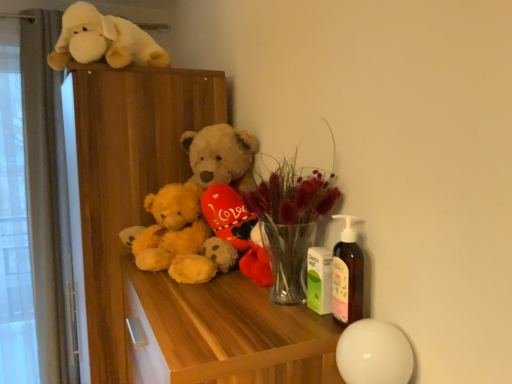
What do you see at coordinates (220, 157) in the screenshot?
I see `fluffy yellow teddy bear at center, which appears as the 2th teddy bear when viewed from the left` at bounding box center [220, 157].

What do you see at coordinates (223, 333) in the screenshot? I see `wooden table at center` at bounding box center [223, 333].

The image size is (512, 384). What are the coordinates of `fluffy yellow teddy bear at center, which appears as the 2th teddy bear when viewed from the left` in the screenshot? It's located at (220, 157).

Is green matte lotion bottle at center, which is the 1th toy in bottom-to-top order, placed right next to translucent glass vase at center?

No.

Considering the sizes of objects green matte lotion bottle at center, the 2th toy positioned from the back, and translucent glass vase at center in the image provided, who is wider, green matte lotion bottle at center, the 2th toy positioned from the back, or translucent glass vase at center?

translucent glass vase at center.

Is green matte lotion bottle at center, the 2th toy positioned from the back, behind translucent glass vase at center?

Yes, green matte lotion bottle at center, the 2th toy positioned from the back, is further from the viewer.

Between wooden table at center and white plush dog at upper left, which is the 2th toy from right to left, which one has more height?

wooden table at center is taller.

Does wooden table at center contain white plush dog at upper left, the 2th toy viewed from the front?

No, wooden table at center does not contain white plush dog at upper left, the 2th toy viewed from the front.

Is wooden table at center thinner than white plush dog at upper left, the first toy positioned from the left?

No.

From the image's perspective, would you say wooden table at center is shown under white plush dog at upper left, which is the first toy in back-to-front order?

Correct, wooden table at center appears lower than white plush dog at upper left, which is the first toy in back-to-front order, in the image.

There is a wooden dresser at upper left. Where is `the 2nd teddy bear above it (from a real-world perspective)`? the 2nd teddy bear above it (from a real-world perspective) is located at coordinates (220, 157).

What's the angular difference between wooden dresser at upper left and fluffy yellow teddy bear at center, which appears as the 2th teddy bear when viewed from the left,'s facing directions?

They differ by 35.8 degrees in their facing directions.

From the image's perspective, which is above, wooden dresser at upper left or fluffy yellow teddy bear at center, which appears as the 2th teddy bear when viewed from the left?

fluffy yellow teddy bear at center, which appears as the 2th teddy bear when viewed from the left, from the image's perspective.

Does wooden dresser at upper left have a lesser width compared to fluffy yellow teddy bear at center, which appears as the 2th teddy bear when viewed from the left?

No, wooden dresser at upper left is not thinner than fluffy yellow teddy bear at center, which appears as the 2th teddy bear when viewed from the left.

Does white plush dog at upper left, the 2th toy viewed from the front, have a greater width compared to wooden table at center?

No, white plush dog at upper left, the 2th toy viewed from the front, is not wider than wooden table at center.

Is white plush dog at upper left, the 2th toy viewed from the front, smaller than wooden table at center?

Yes, white plush dog at upper left, the 2th toy viewed from the front, is smaller than wooden table at center.

In the scene shown: Can you confirm if white plush dog at upper left, the 2th toy viewed from the front, is shorter than wooden table at center?

Indeed, white plush dog at upper left, the 2th toy viewed from the front, has a lesser height compared to wooden table at center.

Which is more to the right, white plush dog at upper left, which is the 2th toy from right to left, or wooden table at center?

Positioned to the right is wooden table at center.

Is fluffy yellow teddy bear at center, the first teddy bear viewed from the right, wider than white plush dog at upper left, placed as the first toy when sorted from top to bottom?

In fact, fluffy yellow teddy bear at center, the first teddy bear viewed from the right, might be narrower than white plush dog at upper left, placed as the first toy when sorted from top to bottom.

Is fluffy yellow teddy bear at center, which appears as the 2th teddy bear when viewed from the left, in front of or behind white plush dog at upper left, the first toy positioned from the left, in the image?

Clearly, fluffy yellow teddy bear at center, which appears as the 2th teddy bear when viewed from the left, is in front of white plush dog at upper left, the first toy positioned from the left.

Which object is positioned more to the left, fluffy yellow teddy bear at center, the first teddy bear viewed from the right, or white plush dog at upper left, the first toy positioned from the left?

Positioned to the left is white plush dog at upper left, the first toy positioned from the left.

From a real-world perspective, who is located lower, translucent glass vase at center or white plush dog at upper left, placed as the first toy when sorted from top to bottom?

translucent glass vase at center, from a real-world perspective.

Is point (305, 274) in front of point (64, 61)?

Yes.

How different are the orientations of translucent glass vase at center and white plush dog at upper left, the 2th toy viewed from the front, in degrees?

The angular difference between translucent glass vase at center and white plush dog at upper left, the 2th toy viewed from the front, is 0.000721 degrees.

Which of these two, translucent glass vase at center or white plush dog at upper left, which is the 2th toy from right to left, is thinner?

translucent glass vase at center.

Is fluffy yellow teddy bear at center, which is counted as the 1th teddy bear, starting from the left, far from green matte lotion bottle at center, the 1th toy from the right?

Actually, fluffy yellow teddy bear at center, which is counted as the 1th teddy bear, starting from the left, and green matte lotion bottle at center, the 1th toy from the right, are a little close together.

Based on the photo, is fluffy yellow teddy bear at center, the second teddy bear in the right-to-left sequence, turned away from green matte lotion bottle at center, the 1th toy from the right?

No, fluffy yellow teddy bear at center, the second teddy bear in the right-to-left sequence, is not facing away from green matte lotion bottle at center, the 1th toy from the right.

In terms of size, does fluffy yellow teddy bear at center, which is counted as the 1th teddy bear, starting from the left, appear bigger or smaller than green matte lotion bottle at center, the 1th toy from the right?

fluffy yellow teddy bear at center, which is counted as the 1th teddy bear, starting from the left, is bigger than green matte lotion bottle at center, the 1th toy from the right.

Consider the image. Is fluffy yellow teddy bear at center, the second teddy bear in the right-to-left sequence, inside or outside of green matte lotion bottle at center, which is the first toy in front-to-back order?

The correct answer is: outside.

Locate an element on the screen. The width and height of the screenshot is (512, 384). floral arrangement located on the left of green matte lotion bottle at center, which is the 1th toy in bottom-to-top order is located at coordinates (290, 223).

At what (x,y) coordinates should I click in order to perform the action: click on the 2nd toy behind the wooden table at center, starting your count from the anchor. Please return your answer as a coordinate pair (x, y). This screenshot has width=512, height=384. Looking at the image, I should click on (103, 40).

Based on their spatial positions, is fluffy yellow teddy bear at center, the second teddy bear in the right-to-left sequence, or wooden table at center closer to wooden dresser at upper left?

Among the two, fluffy yellow teddy bear at center, the second teddy bear in the right-to-left sequence, is located nearer to wooden dresser at upper left.

From the image, which object appears to be nearer to wooden table at center, wooden dresser at upper left or fluffy yellow teddy bear at center, which appears as the 2th teddy bear when viewed from the left?

Based on the image, fluffy yellow teddy bear at center, which appears as the 2th teddy bear when viewed from the left, appears to be nearer to wooden table at center.

Estimate the real-world distances between objects in this image. Which object is closer to fluffy yellow teddy bear at center, which appears as the 2th teddy bear when viewed from the left, green matte lotion bottle at center, which is the 1th toy in bottom-to-top order, or wooden table at center?

wooden table at center is positioned closer to the anchor fluffy yellow teddy bear at center, which appears as the 2th teddy bear when viewed from the left.

Based on their spatial positions, is fluffy yellow teddy bear at center, which appears as the 2th teddy bear when viewed from the left, or translucent glass vase at center closer to wooden dresser at upper left?

fluffy yellow teddy bear at center, which appears as the 2th teddy bear when viewed from the left, is closer to wooden dresser at upper left.

From the picture: When comparing their distances from green matte lotion bottle at center, the second toy in the top-to-bottom sequence, does wooden dresser at upper left or white plush dog at upper left, which is the first toy in back-to-front order, seem further?

Among the two, white plush dog at upper left, which is the first toy in back-to-front order, is located further to green matte lotion bottle at center, the second toy in the top-to-bottom sequence.

Looking at the image, which one is located closer to white plush dog at upper left, the 2th toy viewed from the front, fluffy yellow teddy bear at center, which appears as the 2th teddy bear when viewed from the left, or translucent glass vase at center?

fluffy yellow teddy bear at center, which appears as the 2th teddy bear when viewed from the left, lies closer to white plush dog at upper left, the 2th toy viewed from the front, than the other object.

Estimate the real-world distances between objects in this image. Which object is closer to wooden table at center, translucent glass vase at center or fluffy yellow teddy bear at center, which appears as the 2th teddy bear when viewed from the left?

Among the two, translucent glass vase at center is located nearer to wooden table at center.

When comparing their distances from wooden table at center, does fluffy yellow teddy bear at center, which appears as the 2th teddy bear when viewed from the left, or fluffy yellow teddy bear at center, the second teddy bear in the right-to-left sequence, seem closer?

Among the two, fluffy yellow teddy bear at center, the second teddy bear in the right-to-left sequence, is located nearer to wooden table at center.

In order to click on teddy bear between translucent glass vase at center and fluffy yellow teddy bear at center, which is counted as the 1th teddy bear, starting from the left, in the front-back direction in this screenshot , I will do `click(220, 157)`.

The width and height of the screenshot is (512, 384). What are the coordinates of `toy between fluffy yellow teddy bear at center, the first teddy bear viewed from the right, and wooden table at center from top to bottom` in the screenshot? It's located at (319, 280).

This screenshot has height=384, width=512. I want to click on toy between translucent glass vase at center and fluffy yellow teddy bear at center, which appears as the 2th teddy bear when viewed from the left, along the z-axis, so click(x=319, y=280).

Find the location of `floral arrangement between wooden dresser at upper left and green matte lotion bottle at center, which is the first toy in front-to-back order, in the horizontal direction`. floral arrangement between wooden dresser at upper left and green matte lotion bottle at center, which is the first toy in front-to-back order, in the horizontal direction is located at coordinates (290, 223).